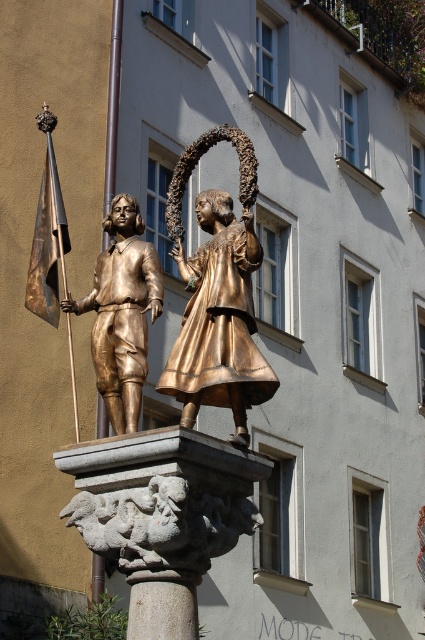
Between bronze statue at left and stone column at center, which one appears on the left side from the viewer's perspective?

bronze statue at left is more to the left.

Between bronze statue at left and stone column at center, which one has more height?

With more height is bronze statue at left.

Does point (127, 288) lie in front of point (150, 637)?

No.

This screenshot has width=425, height=640. Find the location of `bronze statue at left`. bronze statue at left is located at coordinates (122, 314).

Consider the image. Who is positioned more to the left, gold-bronze girl at center or bronze statue at left?

bronze statue at left

Does point (260, 374) come in front of point (119, 244)?

Yes.

Who is more distant from viewer, (266, 372) or (107, 268)?

The point (107, 268) is behind.

The image size is (425, 640). What are the coordinates of `gold-bronze girl at center` in the screenshot? It's located at (218, 296).

Between point (173, 168) and point (130, 602), which one is positioned behind?

Positioned behind is point (173, 168).

Is gold-bronze girl at center below stone column at center?

No, gold-bronze girl at center is not below stone column at center.

Which is in front, point (229, 385) or point (153, 627)?

Point (153, 627) is in front.

You are a GUI agent. You are given a task and a screenshot of the screen. Output one action in this format:
    pyautogui.click(x=<x>, y=<y>)
    Task: Click on the gold-bronze girl at center
    
    Given the screenshot: What is the action you would take?
    (x=218, y=296)